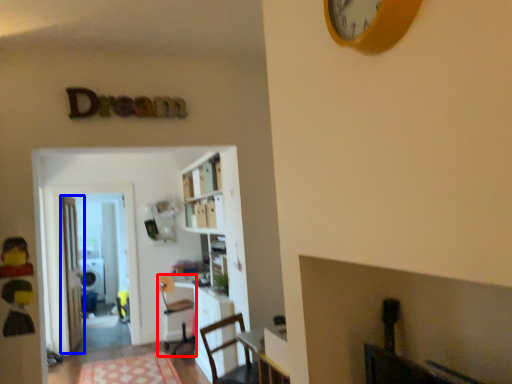
Question: Which point is further to the camera, chair (highlighted by a red box) or door (highlighted by a blue box)?

Choices:
 (A) chair
 (B) door

Answer: (B)